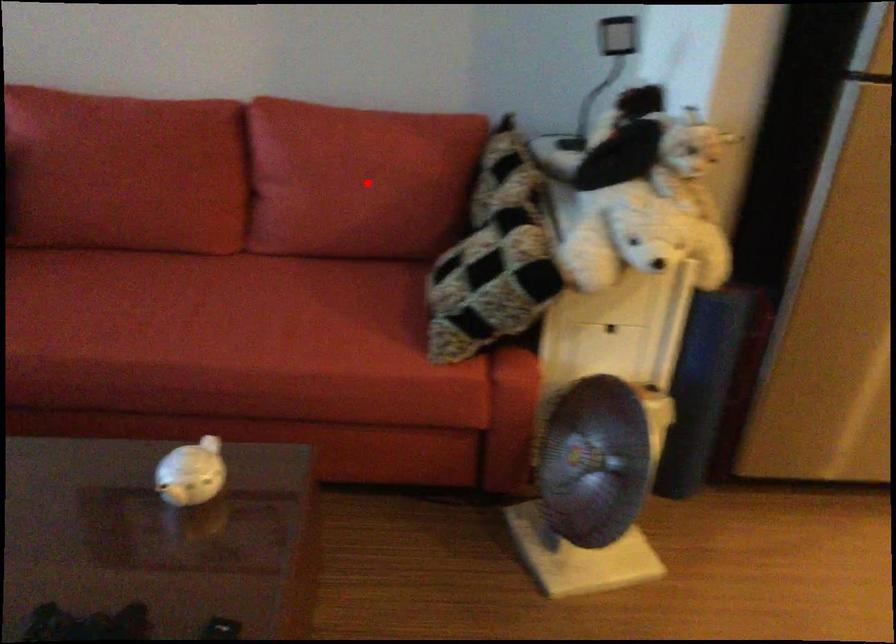
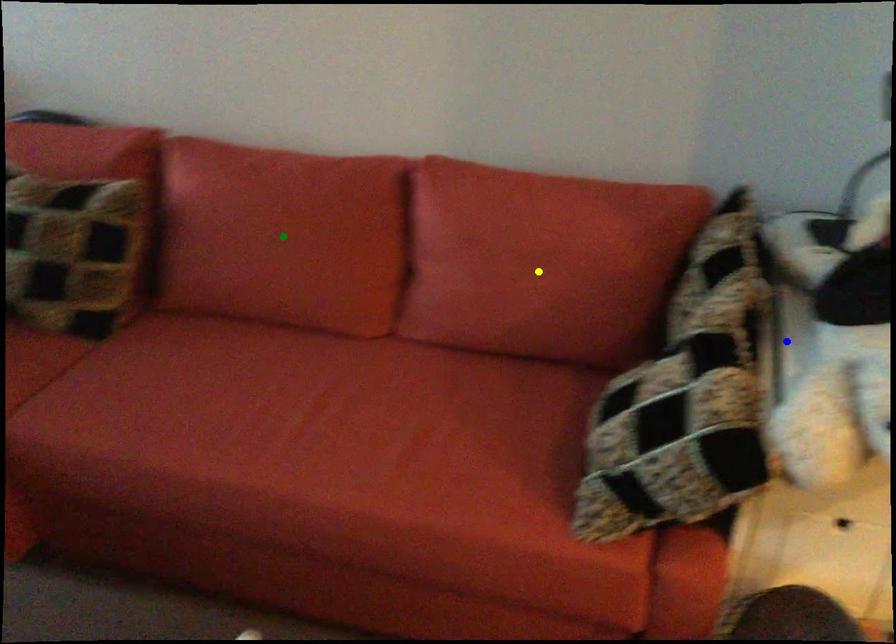
Question: I am providing you with two images of the same scene from different viewpoints. A red point is marked on the first image. You are given multiple points on the second image. Which point in image 2 represents the same 3d spot as the red point in image 1?

Choices:
 (A) yellow point
 (B) green point
 (C) blue point

Answer: (A)